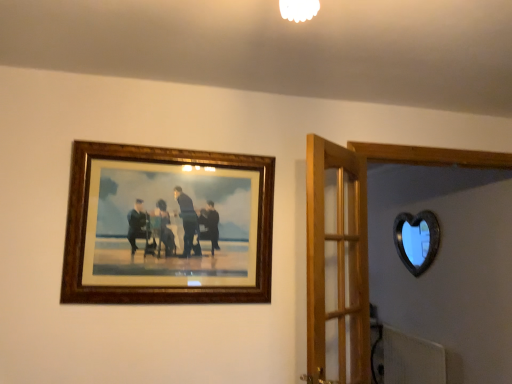
Question: Considering the relative sizes of wooden frame at upper left and black glass heart at upper right in the image provided, is wooden frame at upper left bigger than black glass heart at upper right?

Choices:
 (A) yes
 (B) no

Answer: (A)

Question: From a real-world perspective, is wooden frame at upper left on black glass heart at upper right?

Choices:
 (A) no
 (B) yes

Answer: (B)

Question: Is wooden frame at upper left outside of black glass heart at upper right?

Choices:
 (A) yes
 (B) no

Answer: (A)

Question: From the image's perspective, would you say wooden frame at upper left is shown under black glass heart at upper right?

Choices:
 (A) no
 (B) yes

Answer: (A)

Question: From a real-world perspective, is wooden frame at upper left physically below black glass heart at upper right?

Choices:
 (A) no
 (B) yes

Answer: (A)

Question: Considering the positions of black glass heart at upper right and wooden frame at upper left in the image, is black glass heart at upper right bigger or smaller than wooden frame at upper left?

Choices:
 (A) small
 (B) big

Answer: (A)

Question: Is point (409, 264) positioned closer to the camera than point (69, 228)?

Choices:
 (A) farther
 (B) closer

Answer: (A)

Question: From the image's perspective, relative to wooden frame at upper left, is black glass heart at upper right above or below?

Choices:
 (A) below
 (B) above

Answer: (A)

Question: Is black glass heart at upper right inside or outside of wooden frame at upper left?

Choices:
 (A) outside
 (B) inside

Answer: (A)

Question: In terms of width, does wooden door at center look wider or thinner when compared to wooden frame at upper left?

Choices:
 (A) wide
 (B) thin

Answer: (A)

Question: From the image's perspective, is wooden door at center above or below wooden frame at upper left?

Choices:
 (A) above
 (B) below

Answer: (B)

Question: Considering the relative positions of wooden door at center and wooden frame at upper left in the image provided, is wooden door at center to the left or to the right of wooden frame at upper left?

Choices:
 (A) left
 (B) right

Answer: (B)

Question: Considering the positions of wooden door at center and wooden frame at upper left in the image, is wooden door at center taller or shorter than wooden frame at upper left?

Choices:
 (A) tall
 (B) short

Answer: (A)

Question: Considering the positions of wooden frame at upper left and wooden door at center in the image, is wooden frame at upper left bigger or smaller than wooden door at center?

Choices:
 (A) big
 (B) small

Answer: (B)

Question: From the image's perspective, is wooden frame at upper left located above or below wooden door at center?

Choices:
 (A) above
 (B) below

Answer: (A)